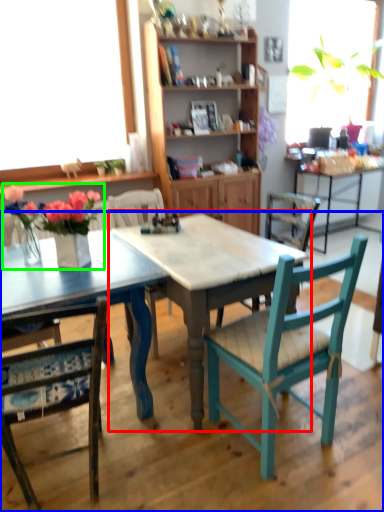
Question: Considering the real-world distances, which object is farthest from round table (highlighted by a red box)? table (highlighted by a blue box) or floral arrangement (highlighted by a green box)?

Choices:
 (A) table
 (B) floral arrangement

Answer: (B)